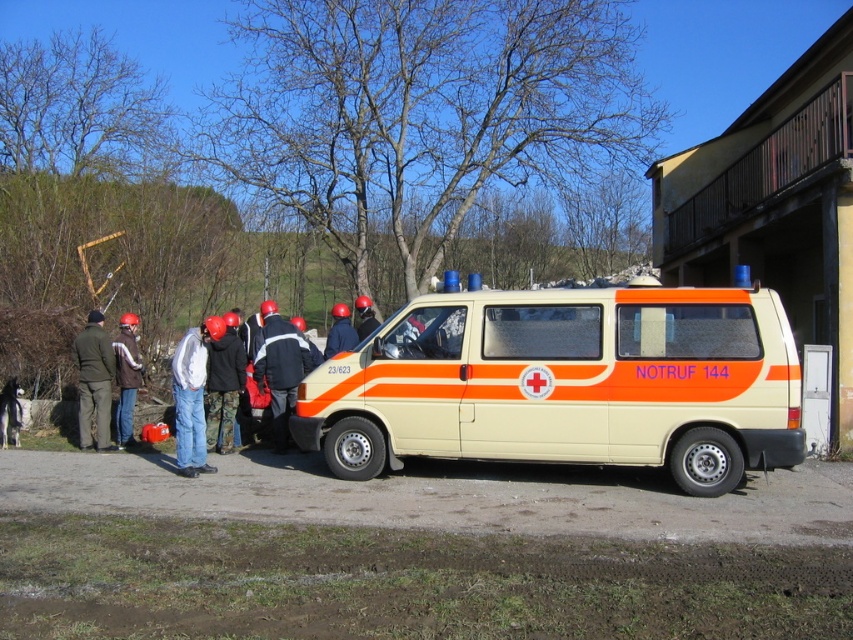
Question: Estimate the real-world distances between objects in this image. Which object is closer to the dark blue uniform at center?

Choices:
 (A) khaki fabric jacket at left
 (B) matte black jacket at center
 (C) dark brown leather jacket at left

Answer: (B)

Question: Does dark blue uniform at center appear under black fabric helmet at center?

Choices:
 (A) no
 (B) yes

Answer: (B)

Question: Observing the image, what is the correct spatial positioning of matte orange helmet at center in reference to black fabric helmet at center?

Choices:
 (A) left
 (B) right

Answer: (A)

Question: Is dark blue uniform at center wider than dark brown leather jacket at left?

Choices:
 (A) no
 (B) yes

Answer: (B)

Question: Which point appears closest to the camera in this image?

Choices:
 (A) pyautogui.click(x=119, y=435)
 (B) pyautogui.click(x=296, y=328)

Answer: (B)

Question: Which point is farther to the camera?

Choices:
 (A) (714, 376)
 (B) (363, 326)

Answer: (B)